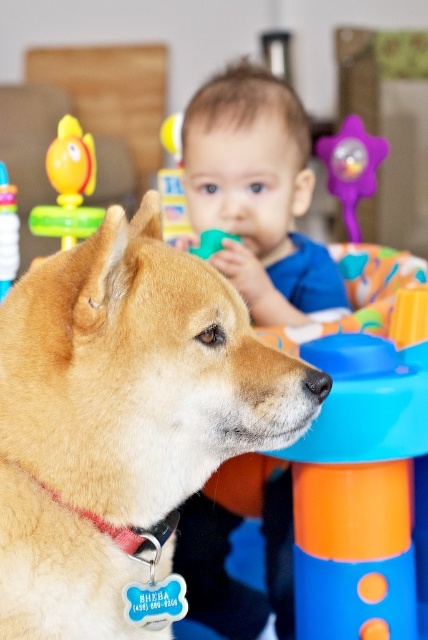
Question: Which point is closer to the camera taking this photo?

Choices:
 (A) (71, 163)
 (B) (237, 273)
 (C) (163, 540)
 (D) (2, 572)

Answer: (D)

Question: Does blue cotton shirt at center appear on the right side of purple plastic star at upper center?

Choices:
 (A) yes
 (B) no

Answer: (B)

Question: Which object is farther from the camera taking this photo?

Choices:
 (A) blue cotton shirt at center
 (B) rubberized plastic block at upper center
 (C) blue cotton shirt at upper center

Answer: (B)

Question: Observing the image, what is the correct spatial positioning of blue cotton shirt at upper center in reference to rubber duck at left?

Choices:
 (A) above
 (B) below

Answer: (A)

Question: Which point is farther to the camera?

Choices:
 (A) (202, 112)
 (B) (169, 492)

Answer: (A)

Question: Is golden fur dog at center to the left of rubber duck at left from the viewer's perspective?

Choices:
 (A) no
 (B) yes

Answer: (A)